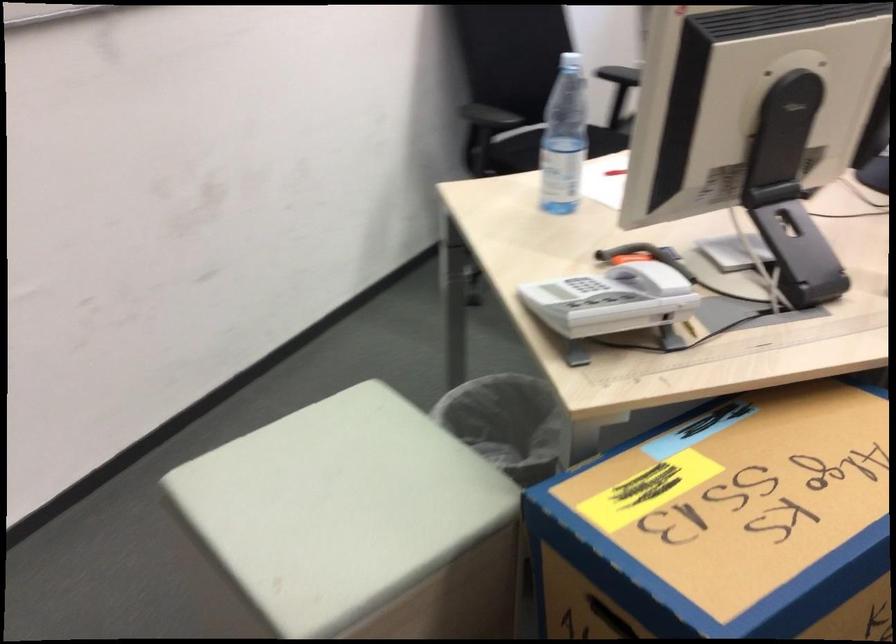
Where is `cardboard box handle`? This screenshot has height=644, width=896. cardboard box handle is located at coordinates (600, 617).